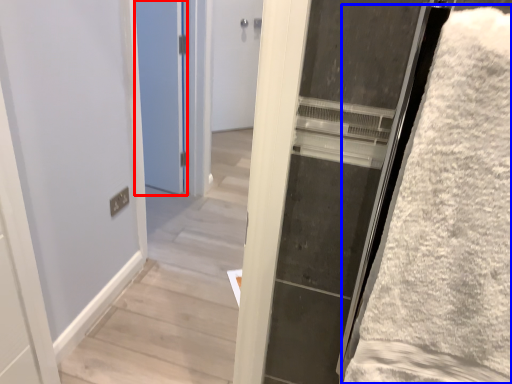
Question: Among these objects, which one is farthest to the camera, door (highlighted by a red box) or bath towel (highlighted by a blue box)?

Choices:
 (A) door
 (B) bath towel

Answer: (A)